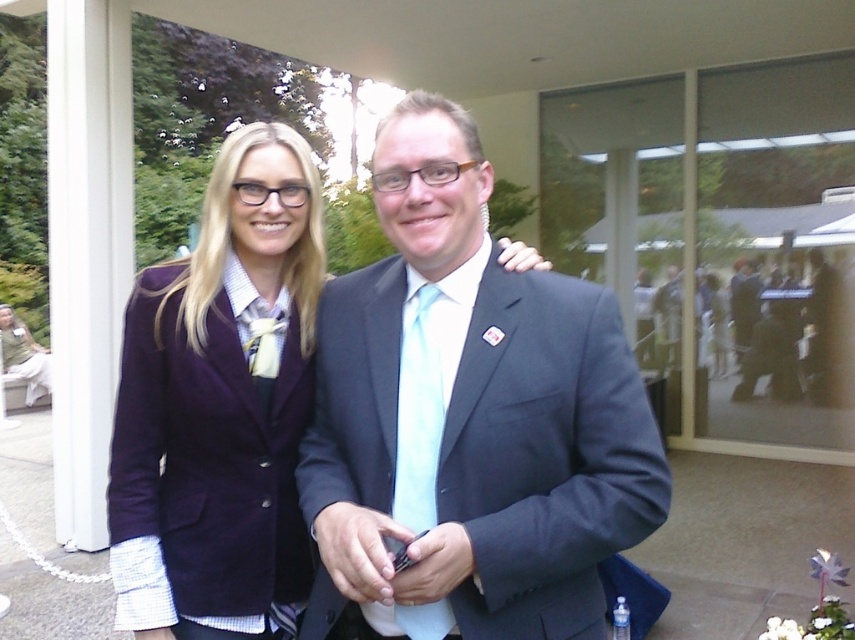
Question: Which of the following is the farthest from the observer?

Choices:
 (A) (223, 241)
 (B) (428, 396)

Answer: (A)

Question: Which point appears closest to the camera in this image?

Choices:
 (A) (287, 321)
 (B) (394, 182)

Answer: (B)

Question: Among these objects, which one is nearest to the camera?

Choices:
 (A) matte black suit at center
 (B) purple velvet blazer at center

Answer: (A)

Question: Can you confirm if matte black suit at center is positioned above purple velvet blazer at center?

Choices:
 (A) no
 (B) yes

Answer: (B)

Question: Can you confirm if matte black suit at center is thinner than purple velvet blazer at center?

Choices:
 (A) no
 (B) yes

Answer: (A)

Question: Is matte black suit at center bigger than purple velvet blazer at center?

Choices:
 (A) no
 (B) yes

Answer: (B)